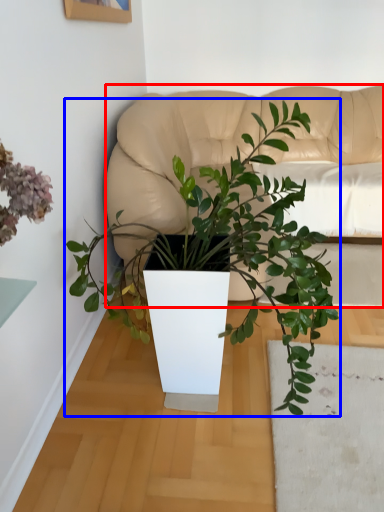
Question: Which of the following is the farthest to the observer, couch (highlighted by a red box) or houseplant (highlighted by a blue box)?

Choices:
 (A) couch
 (B) houseplant

Answer: (A)